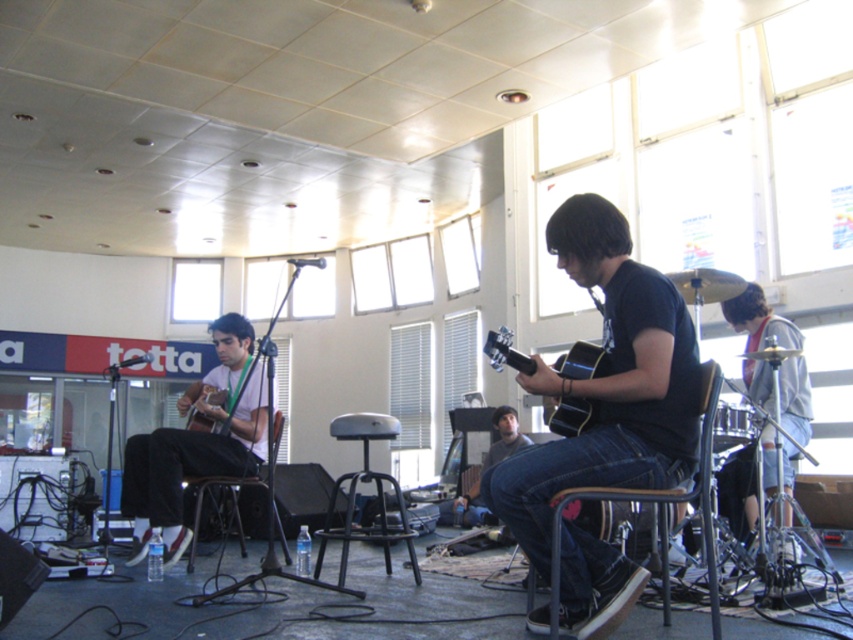
Question: Does metallic gray stool at center have a greater width compared to black plastic chair at lower left?

Choices:
 (A) yes
 (B) no

Answer: (A)

Question: Which is farther from the matte white shirt at center?

Choices:
 (A) matte brown acoustic guitar at left
 (B) metallic gray stool at center
 (C) acoustic wood guitar at center

Answer: (C)

Question: Among these points, which one is farthest from the camera?

Choices:
 (A) (234, 502)
 (B) (201, 428)
 (C) (483, 522)

Answer: (C)

Question: Considering the relative positions of matte white shirt at center and gray fabric shirt at right in the image provided, where is matte white shirt at center located with respect to gray fabric shirt at right?

Choices:
 (A) right
 (B) left

Answer: (B)

Question: Which point is closer to the camera taking this photo?

Choices:
 (A) (212, 429)
 (B) (491, 358)
 (C) (334, 538)

Answer: (B)

Question: Does matte white shirt at center have a smaller size compared to black metal chair at center?

Choices:
 (A) no
 (B) yes

Answer: (A)